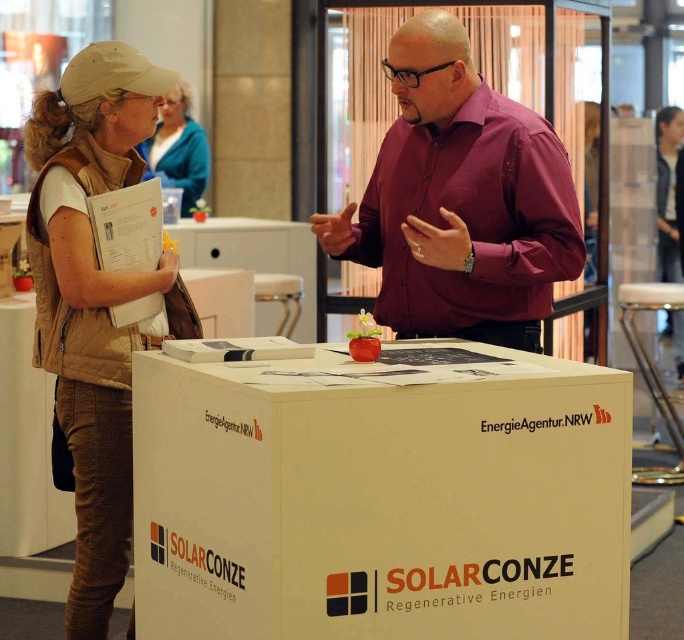
Where is the burgundy shirt at center located in the image?

The burgundy shirt at center is located at point (460, 200) in the image.

You are trying to determine the spatial relationship between the two people in the scene. Which clothing item is closer to you, the observer, between the brown fabric vest at left and the blue fabric jacket at upper center?

The brown fabric vest at left is closer to you because it is in front of the blue fabric jacket at upper center.

You are organizing a clothing donation drive and need to categorize items by size. If you have a brown fabric vest at left and a blue fabric jacket at upper center, which item is wider?

The blue fabric jacket at upper center is wider than the brown fabric vest at left.